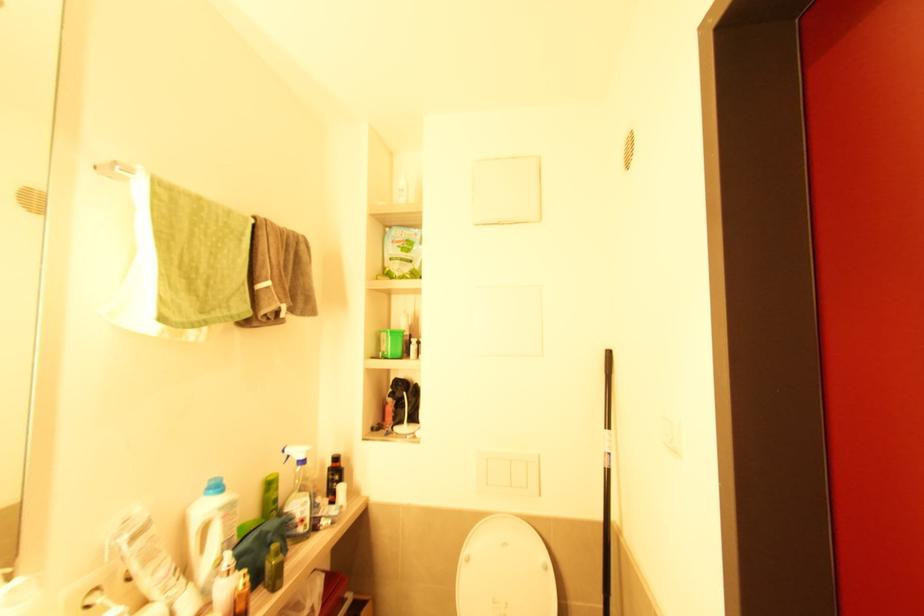
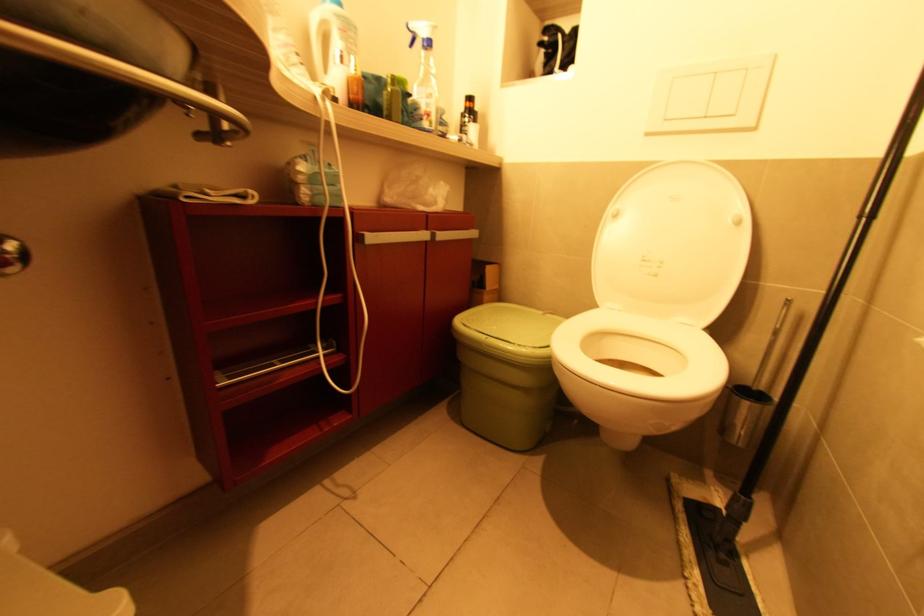
The point at [469,561] is marked in the first image. Where is the corresponding point in the second image?

(617, 217)